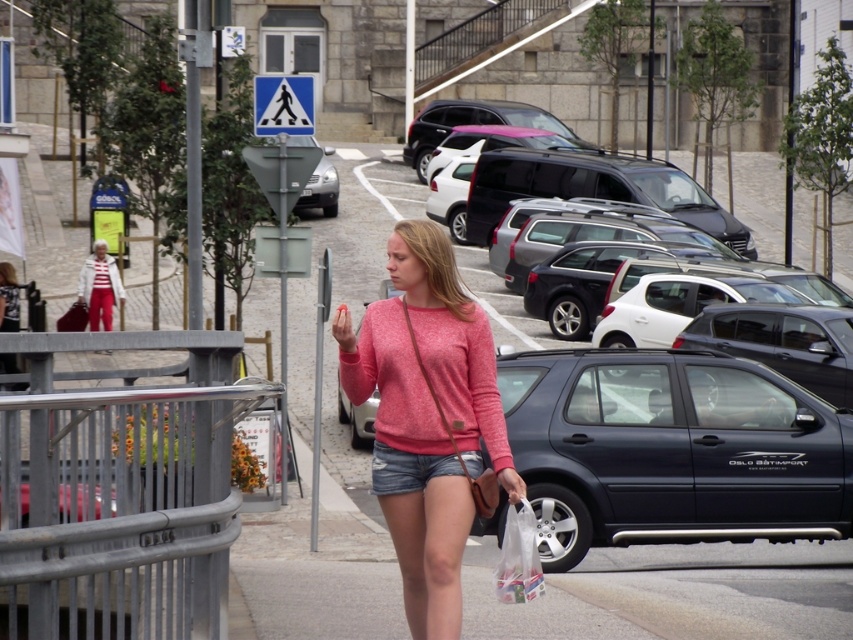
You are a delivery person standing on the sidewalk. You need to place a package on top of the matte black suv at center or the matte pink sweater at center. Which object can you place the package on without needing a ladder?

The matte black suv at center is taller than the matte pink sweater at center, so you can place the package on the matte black suv at center without needing a ladder since it is higher.

You are standing at the pedestrian crossing sign and want to move towards the point with coordinates point (625, 387) and point (535, 532). Which point should you move towards first to reach the closer one first?

You should move towards point (625, 387) first because it is closer to you than point (535, 532), which is further away.